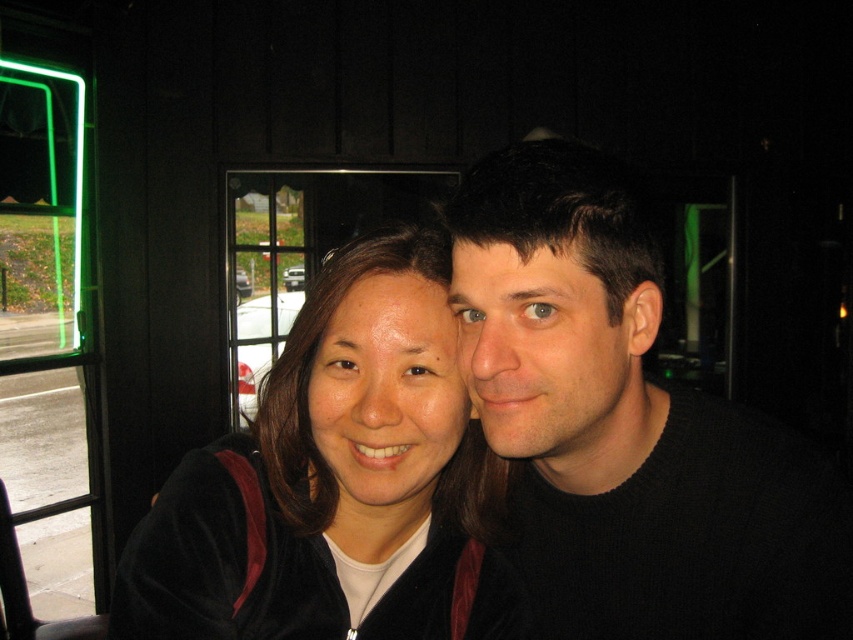
Which is below, velvet black jacket at center or green neon sign at left?

Positioned lower is velvet black jacket at center.

Is the position of velvet black jacket at center less distant than that of green neon sign at left?

Yes, velvet black jacket at center is closer to the viewer.

This screenshot has height=640, width=853. Find the location of `velvet black jacket at center`. velvet black jacket at center is located at coordinates (332, 480).

Identify the location of velvet black jacket at center. Image resolution: width=853 pixels, height=640 pixels. (332, 480).

Does black velvety jacket at center have a greater width compared to green neon sign at left?

No, black velvety jacket at center is not wider than green neon sign at left.

Locate an element on the screen. The width and height of the screenshot is (853, 640). black velvety jacket at center is located at coordinates (625, 426).

Does black velvety jacket at center have a lesser height compared to velvet black jacket at center?

In fact, black velvety jacket at center may be taller than velvet black jacket at center.

Is point (538, 218) closer to camera compared to point (361, 371)?

Yes, it is in front of point (361, 371).

I want to click on black velvety jacket at center, so click(x=625, y=426).